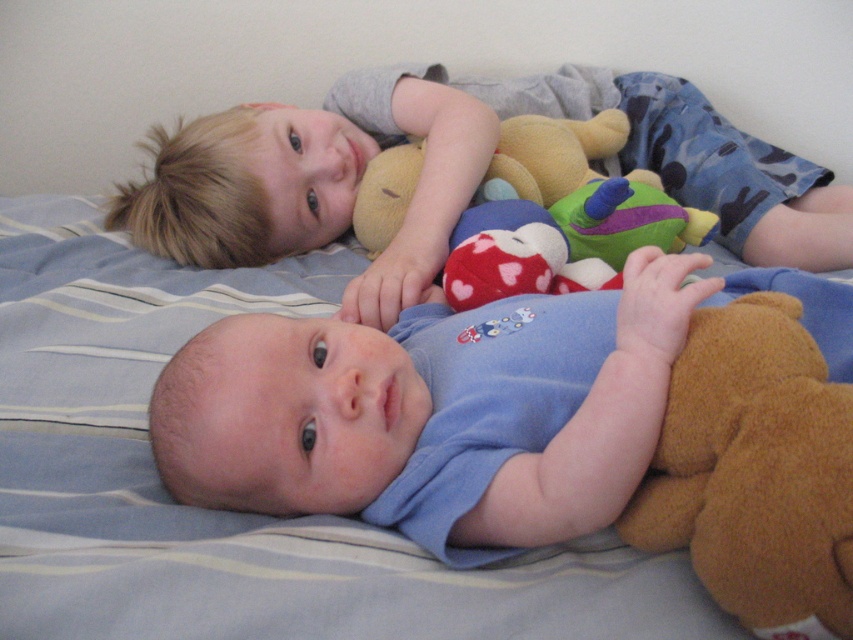
Looking at this image, you are a toy designer who wants to create a storage box for the blue soft baby at center and the brown plush bear at lower right. Considering their sizes, which one requires a larger storage box?

The blue soft baby at center requires a larger storage box because it is much taller than the brown plush bear at lower right.

You are trying to place a new toy on the bed but want to ensure it doesn not fall off the side. Given the current arrangement, which side of the blue soft bed at center is closer to the brown plush bear at lower right?

The brown plush bear at lower right is positioned to the right of the blue soft bed at center, so the right side of the blue soft bed at center is closer to the brown plush bear at lower right. Placing the new toy on the right side would keep it nearer to the existing bear and reduce the chance of it falling off that side.